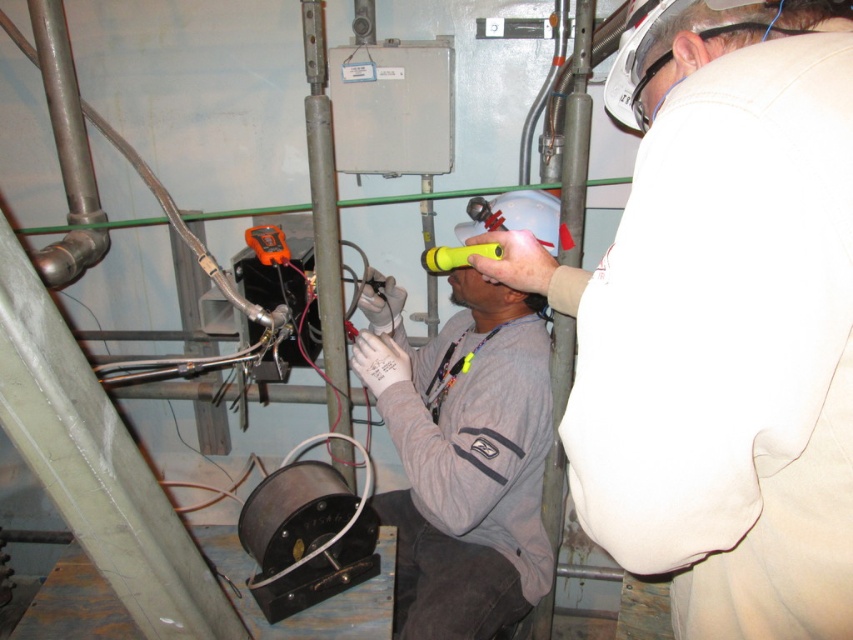
Is point (698, 56) positioned behind point (384, 374)?

That is False.

Who is higher up, white matte helmet at upper center or gray matte shirt at center?

white matte helmet at upper center is higher up.

Between point (851, 536) and point (521, 410), which one is positioned behind?

Positioned behind is point (521, 410).

What are the coordinates of `white matte helmet at upper center` in the screenshot? It's located at (722, 326).